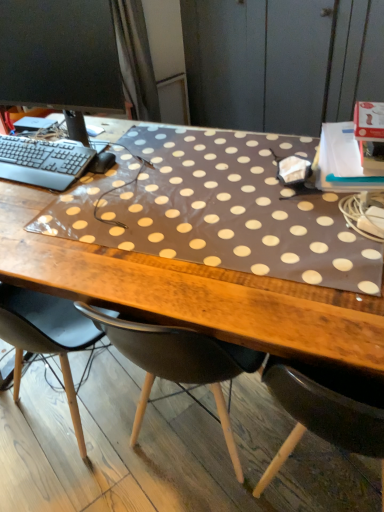
At what (x,y) coordinates should I click in order to perform the action: click on free space in front of black glossy monitor at upper left. Please return your answer as a coordinate pair (x, y). Looking at the image, I should click on (80, 202).